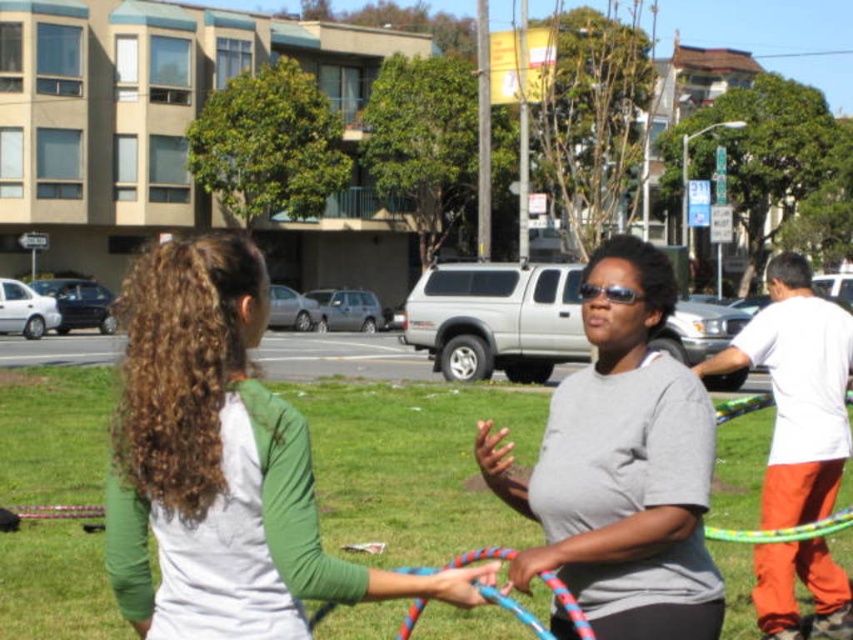
Question: Which of the following is the closest to the observer?

Choices:
 (A) rope-textured hula hoop at center
 (B) gray matte shirt at center

Answer: (A)

Question: Can you confirm if green grass at center is wider than rope-textured hula hoop at center?

Choices:
 (A) no
 (B) yes

Answer: (B)

Question: Which of the following is the farthest from the observer?

Choices:
 (A) (669, 609)
 (B) (250, 573)
 (C) (483, 388)
 (D) (540, 625)

Answer: (C)

Question: Is green fabric shirt at center positioned behind rope-textured hula hoop at center?

Choices:
 (A) yes
 (B) no

Answer: (B)

Question: Observing the image, what is the correct spatial positioning of green grass at center in reference to green fabric shirt at center?

Choices:
 (A) left
 (B) right

Answer: (B)

Question: Based on their relative distances, which object is nearer to the gray matte shirt at center?

Choices:
 (A) green grass at center
 (B) rope-textured hula hoop at center
 (C) green fabric shirt at center

Answer: (B)